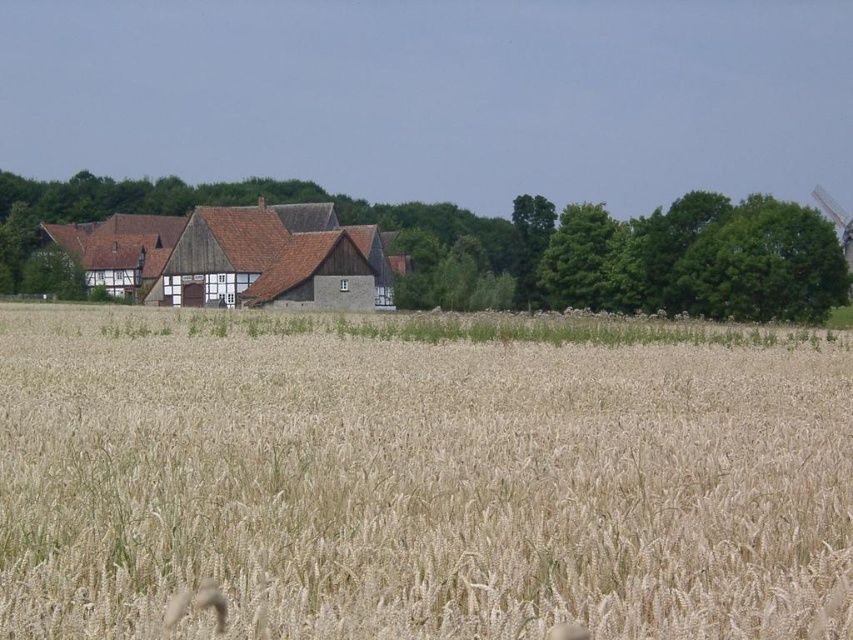
You are standing at the center of the image. Which direction should you face to see the golden wheat field at center?

The golden wheat field at center is located at point coordinates of [421,476]. Since you are at the center of the image, facing towards the golden wheat field at center would require facing towards the coordinates [421,476]. This means you should face slightly to the right and forward to see it.

You are standing at the point marked as point (421, 476) in the image. What is the most prominent feature directly beneath your feet?

The golden wheat field at center is located at point (421, 476), so the most prominent feature directly beneath your feet would be the golden wheat field at center.

You are a farmer who needs to transport harvested wheat from the golden wheat field at center to the brown wooden barn at center. Given that your tractor can carry a maximum load of 500 kg and travels at 15 km per hour, how long will it take to make a round trip between the two locations?

The golden wheat field at center and brown wooden barn at center are 189.54 feet apart from each other. Converting this distance to kilometers, 189.54 feet is approximately 0.0578 kilometers. A round trip would be double that distance, totaling approximately 0.1156 kilometers. At a speed of 15 km per hour, the time taken would be distance divided by speed, so 0.1156 km divided by 15 km per hour equals approximately 0.0077 hours. Converting hours to minutes by multiplying by 60, this results in roughly 0.462